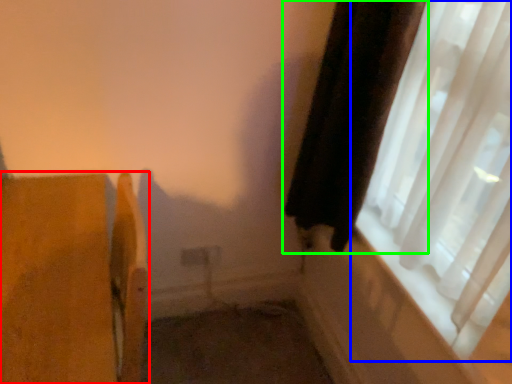
Question: Estimate the real-world distances between objects in this image. Which object is closer to furniture (highlighted by a red box), window (highlighted by a blue box) or curtain (highlighted by a green box)?

Choices:
 (A) window
 (B) curtain

Answer: (B)